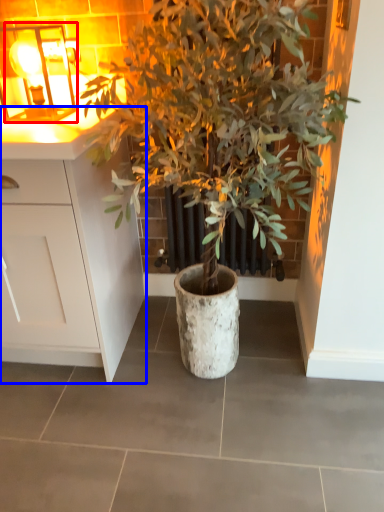
Question: Among these objects, which one is farthest to the camera, light fixture (highlighted by a red box) or cabinetry (highlighted by a blue box)?

Choices:
 (A) light fixture
 (B) cabinetry

Answer: (A)